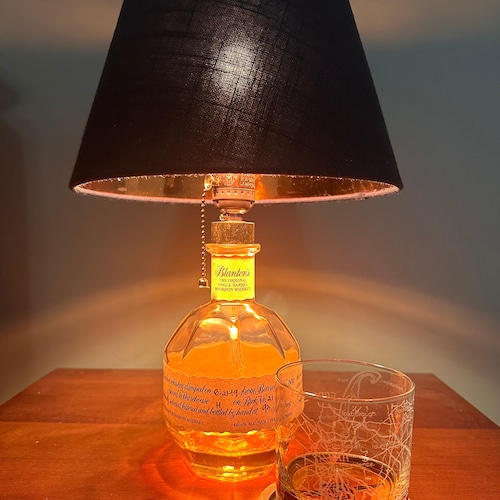
Find the location of a particular element. Image resolution: width=500 pixels, height=500 pixels. wood tabletop is located at coordinates (64, 426).